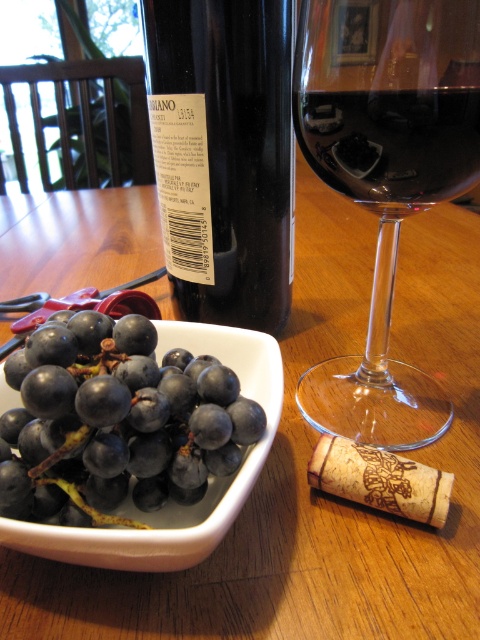
Is black glass bottle at center thinner than dark red liquid at center?

No, black glass bottle at center is not thinner than dark red liquid at center.

Does point (210, 104) lie in front of point (467, 140)?

No, (210, 104) is further to viewer.

At what (x,y) coordinates should I click in order to perform the action: click on black glass bottle at center. Please return your answer as a coordinate pair (x, y). Looking at the image, I should click on (228, 154).

Is the position of transparent glass wine glass at center more distant than that of black glass bottle at center?

No, transparent glass wine glass at center is closer to the viewer.

Is transparent glass wine glass at center to the right of black glass bottle at center from the viewer's perspective?

Indeed, transparent glass wine glass at center is positioned on the right side of black glass bottle at center.

Which is behind, point (429, 396) or point (241, 305)?

Positioned behind is point (241, 305).

The width and height of the screenshot is (480, 640). I want to click on transparent glass wine glass at center, so click(x=385, y=177).

Between transparent glass wine glass at center and dark red liquid at center, which one has less height?

Standing shorter between the two is dark red liquid at center.

Is point (448, 81) positioned in front of point (423, 196)?

Yes, point (448, 81) is closer to viewer.

Is point (471, 6) in front of point (360, 134)?

Yes, it is.

Where is `transparent glass wine glass at center`? Image resolution: width=480 pixels, height=640 pixels. transparent glass wine glass at center is located at coordinates (385, 177).